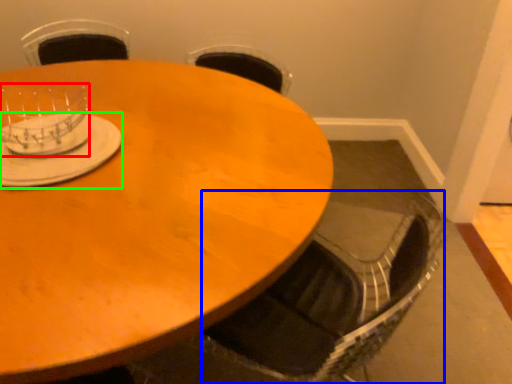
Question: Which object is positioned closest to tableware (highlighted by a red box)? Select from swivel chair (highlighted by a blue box) and tableware (highlighted by a green box).

Choices:
 (A) swivel chair
 (B) tableware

Answer: (B)